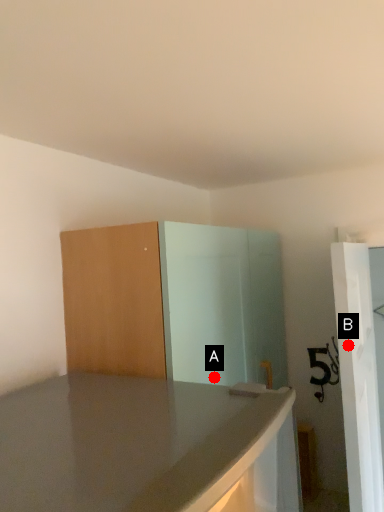
Question: Two points are circled on the image, labeled by A and B beside each circle. Which point appears closest to the camera in this image?

Choices:
 (A) A is closer
 (B) B is closer

Answer: (B)